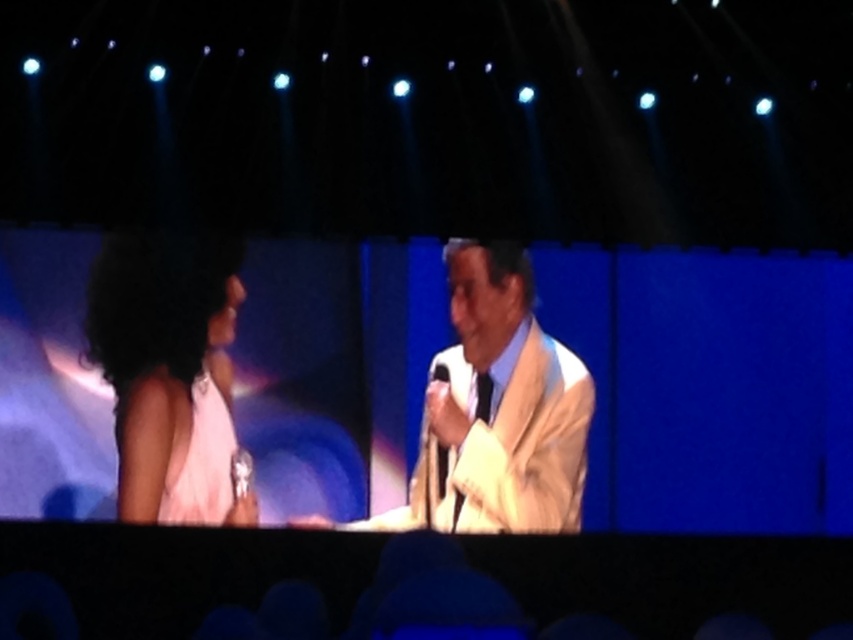
Question: Can you confirm if pink satin dress at left is smaller than metallic silver microphone at center?

Choices:
 (A) yes
 (B) no

Answer: (B)

Question: Which point is farther from the camera taking this photo?

Choices:
 (A) (194, 385)
 (B) (440, 484)
 (C) (447, 484)

Answer: (A)

Question: Is matte white dress at left smaller than metallic silver microphone at center?

Choices:
 (A) no
 (B) yes

Answer: (A)

Question: Is pink satin dress at left to the right of metallic silver microphone at center from the viewer's perspective?

Choices:
 (A) no
 (B) yes

Answer: (A)

Question: Among these objects, which one is farthest from the camera?

Choices:
 (A) metallic silver microphone at center
 (B) matte white dress at left
 (C) pink satin dress at left
 (D) light beige suit at center

Answer: (A)

Question: Which of the following is the closest to the observer?

Choices:
 (A) (164, 509)
 (B) (444, 372)
 (C) (91, 358)
 (D) (582, 374)

Answer: (C)